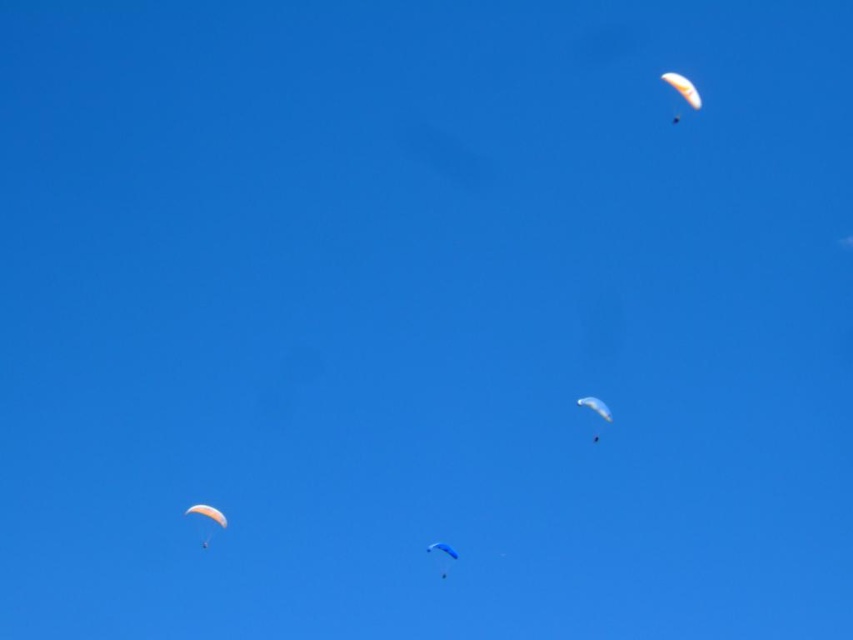
Between white matte parachute at lower left and blue fabric parachute at center, which one has more height?

Standing taller between the two is blue fabric parachute at center.

Describe the element at coordinates (207, 513) in the screenshot. The image size is (853, 640). I see `white matte parachute at lower left` at that location.

The height and width of the screenshot is (640, 853). I want to click on white matte parachute at lower left, so click(x=207, y=513).

Who is taller, white matte parachute at lower left or white matte parachute at center?

white matte parachute at center

Does white matte parachute at lower left appear on the right side of white matte parachute at center?

No, white matte parachute at lower left is not to the right of white matte parachute at center.

Is point (196, 513) positioned before point (589, 406)?

No, (196, 513) is further to viewer.

I want to click on white matte parachute at lower left, so click(x=207, y=513).

Does white matte parachute at center appear on the right side of blue fabric parachute at center?

Yes, white matte parachute at center is to the right of blue fabric parachute at center.

This screenshot has width=853, height=640. In order to click on white matte parachute at center in this screenshot , I will do `click(595, 406)`.

Who is more forward, (x=595, y=406) or (x=433, y=548)?

Point (x=595, y=406) is in front.

What are the coordinates of `white matte parachute at center` in the screenshot? It's located at (595, 406).